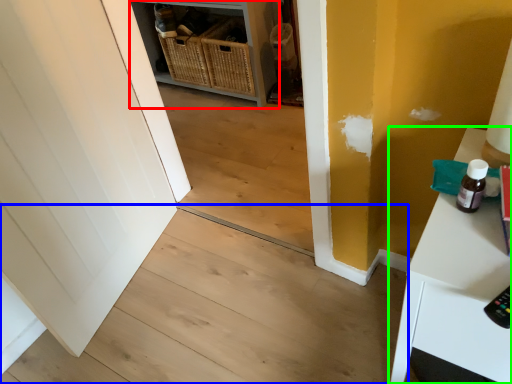
Question: Which object is positioned closest to shelf (highlighted by a red box)? Select from stair (highlighted by a blue box) and table (highlighted by a green box).

Choices:
 (A) stair
 (B) table

Answer: (A)